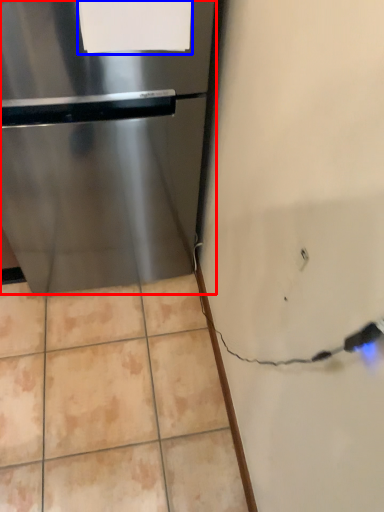
Question: Which point is further to the camera, refrigerator (highlighted by a red box) or paper (highlighted by a blue box)?

Choices:
 (A) refrigerator
 (B) paper

Answer: (A)